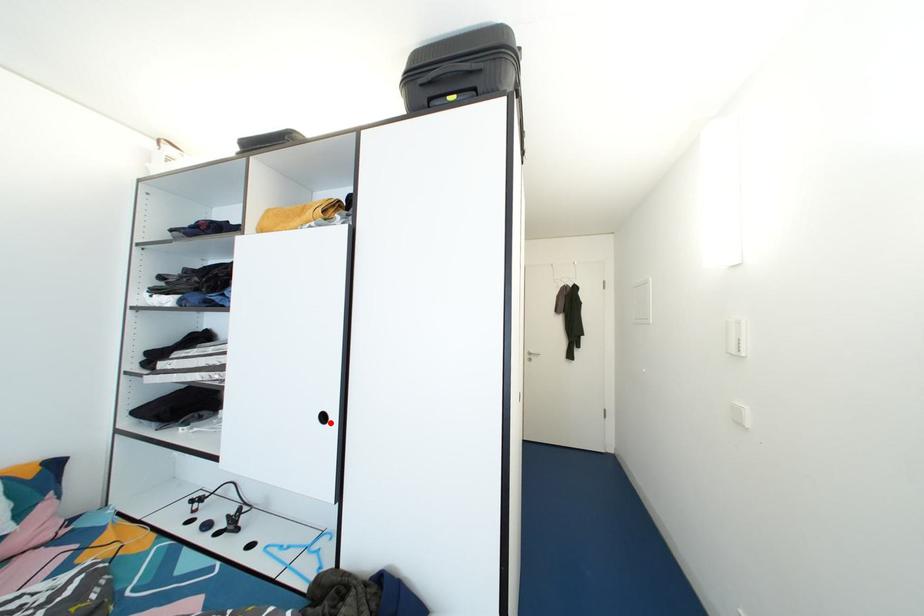
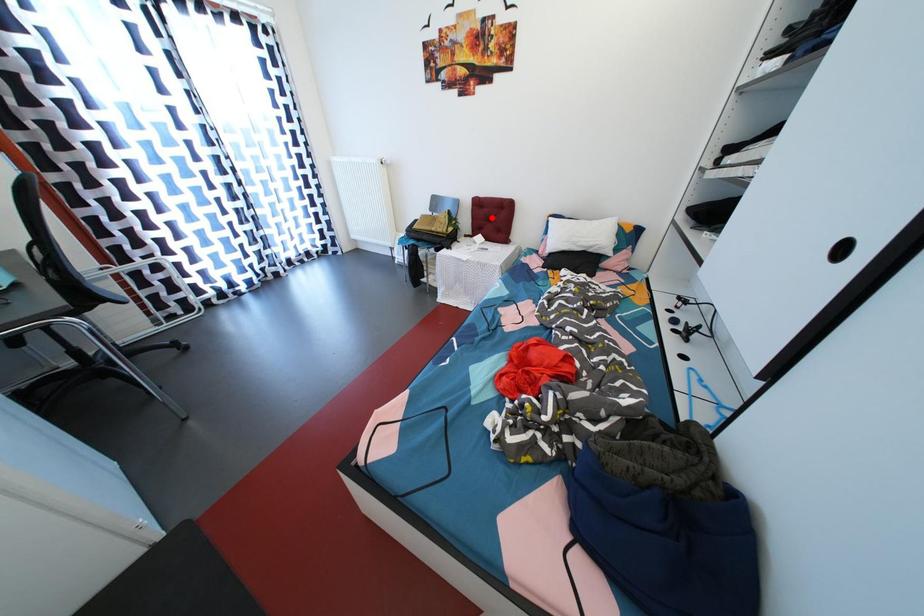
I am providing you with two images of the same scene from different viewpoints. A red point is marked on the first image and another point is marked on the second image. Is the marked point in image1 the same physical position as the marked point in image2?

No